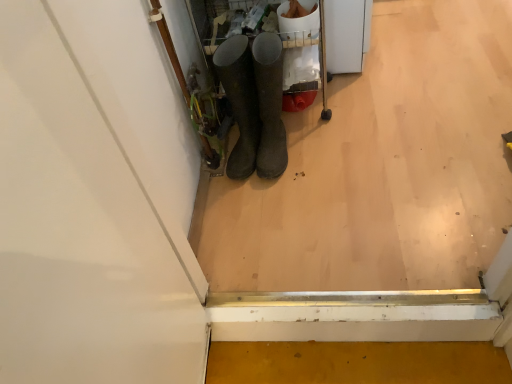
The width and height of the screenshot is (512, 384). Identify the location of vacant location below dark brown rubber boots at center (from a real-world perspective). (282, 165).